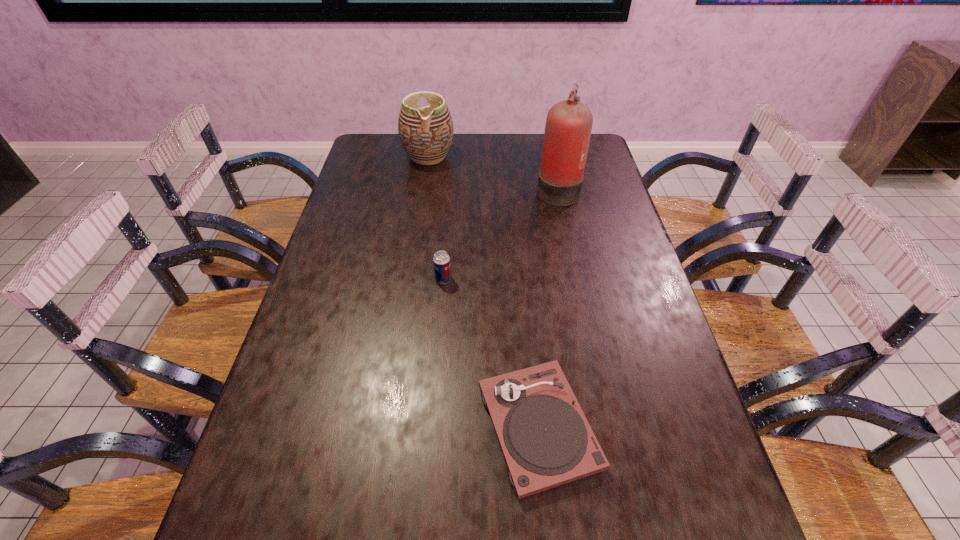
The image size is (960, 540). In order to click on blank space located 0.230m on the left of the second nearest object in this screenshot , I will do `click(350, 280)`.

At what (x,y) coordinates should I click in order to perform the action: click on vacant space positioned 0.330m on the back of the phonograph_record. Please return your answer as a coordinate pair (x, y). Looking at the image, I should click on (523, 266).

At what (x,y) coordinates should I click in order to perform the action: click on object located at the far edge. Please return your answer as a coordinate pair (x, y). The height and width of the screenshot is (540, 960). Looking at the image, I should click on (426, 133).

In order to click on object that is positioned at the left edge in this screenshot , I will do `click(426, 133)`.

Locate an element on the screen. The image size is (960, 540). object located at the right edge is located at coordinates (568, 127).

At what (x,y) coordinates should I click in order to perform the action: click on object that is at the far left corner. Please return your answer as a coordinate pair (x, y). This screenshot has width=960, height=540. Looking at the image, I should click on (426, 133).

Image resolution: width=960 pixels, height=540 pixels. Find the location of `vacant space at the far edge of the desktop`. vacant space at the far edge of the desktop is located at coordinates point(524,161).

Where is `free space at the left edge of the desktop`? Image resolution: width=960 pixels, height=540 pixels. free space at the left edge of the desktop is located at coordinates (316, 333).

Locate an element on the screen. The image size is (960, 540). blank space at the right edge of the desktop is located at coordinates (600, 329).

What are the coordinates of `vacant space at the far left corner of the desktop` in the screenshot? It's located at (377, 140).